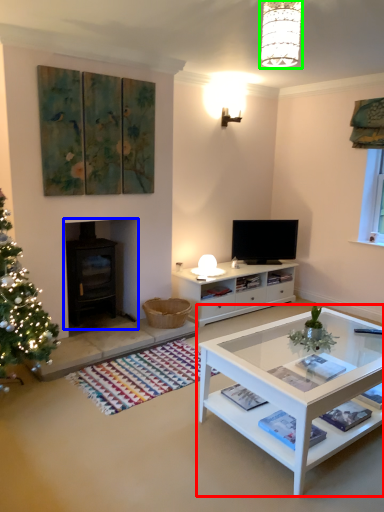
Question: Which object is the closest to the coffee table (highlighted by a red box)? Choose among these: fireplace (highlighted by a blue box) or lamp (highlighted by a green box).

Choices:
 (A) fireplace
 (B) lamp

Answer: (A)